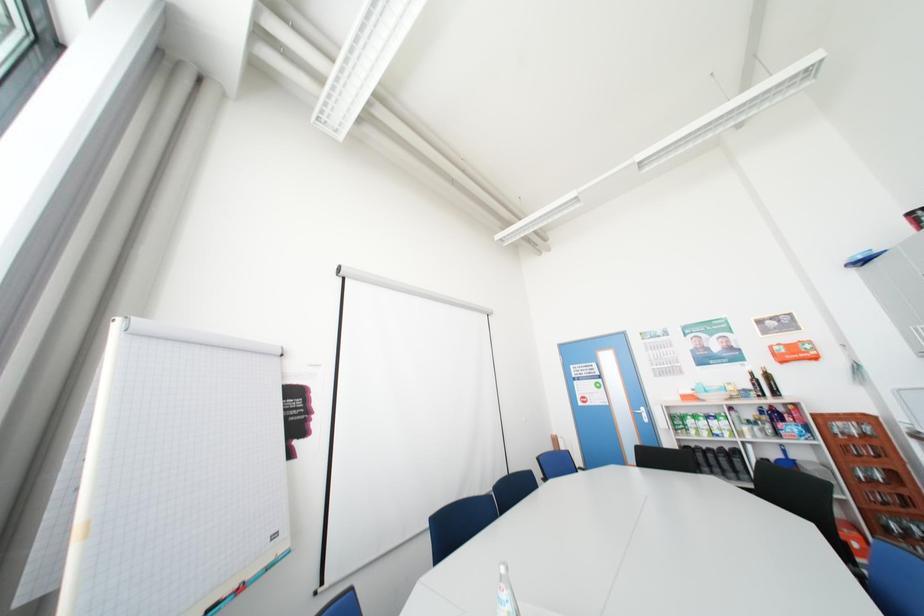
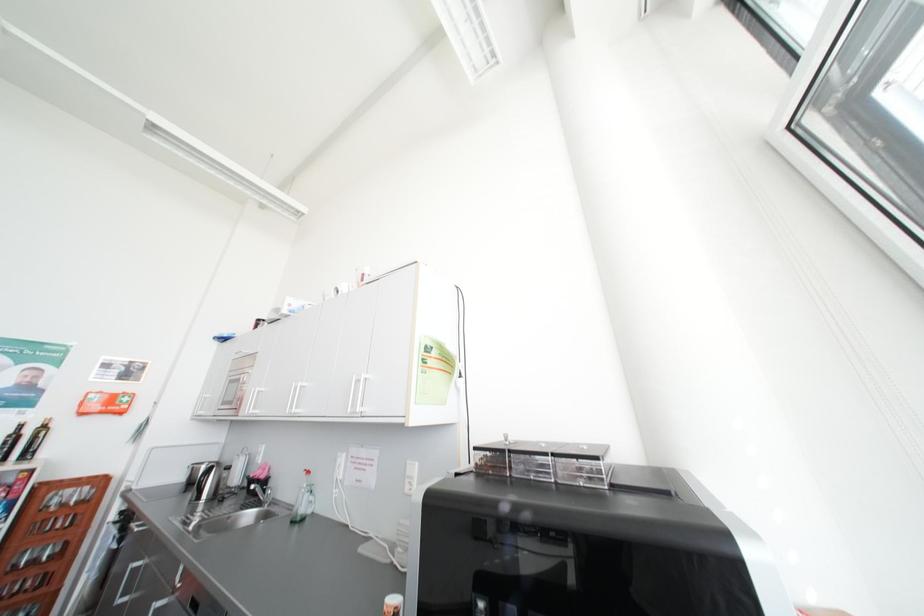
The images are taken continuously from a first-person perspective. In which direction is your viewpoint rotating?

The rotation direction of the camera is right-up.